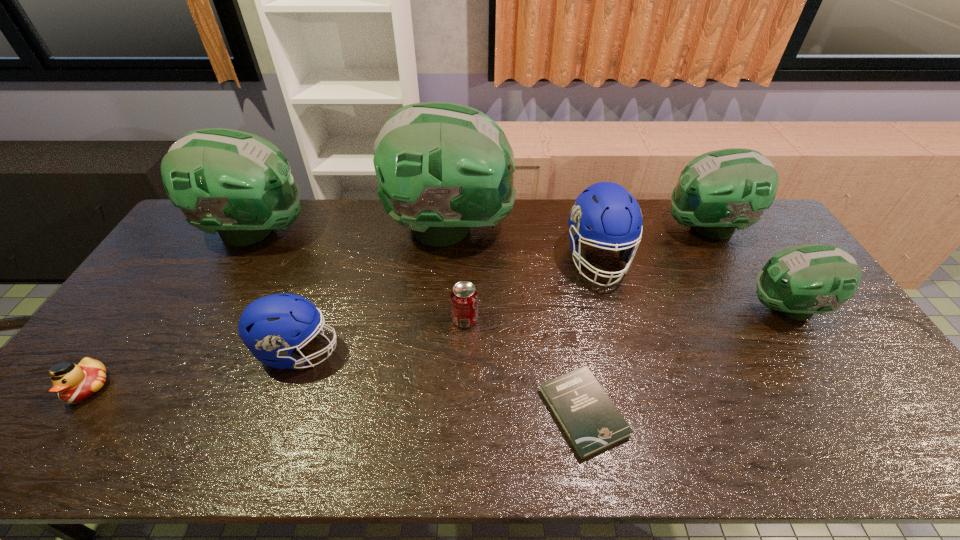
Locate an element on the screen. duck present at the left edge is located at coordinates (74, 383).

Where is `object positioned at the far left corner`? object positioned at the far left corner is located at coordinates (238, 184).

What are the coordinates of `object located in the far right corner section of the desktop` in the screenshot? It's located at (719, 191).

Image resolution: width=960 pixels, height=540 pixels. I want to click on free space at the far edge, so click(393, 228).

Locate an element on the screen. free space at the near edge is located at coordinates (486, 450).

You are a GUI agent. You are given a task and a screenshot of the screen. Output one action in this format:
    pyautogui.click(x=<x>, y=<y>)
    Task: Click on the free location at the left edge
    
    Given the screenshot: What is the action you would take?
    pyautogui.click(x=133, y=353)

In the image, there is a desktop. Identify the location of free space at the far right corner. This screenshot has width=960, height=540. (758, 224).

Identify the location of vacant space at the near right corner. The height and width of the screenshot is (540, 960). pyautogui.click(x=897, y=450).

Locate an element on the screen. Image resolution: width=960 pixels, height=540 pixels. unoccupied position between the leftmost green football helmet and the bigger blue football helmet is located at coordinates (427, 245).

This screenshot has height=540, width=960. In order to click on free space between the dark book and the third biggest green football helmet in this screenshot , I will do `click(644, 320)`.